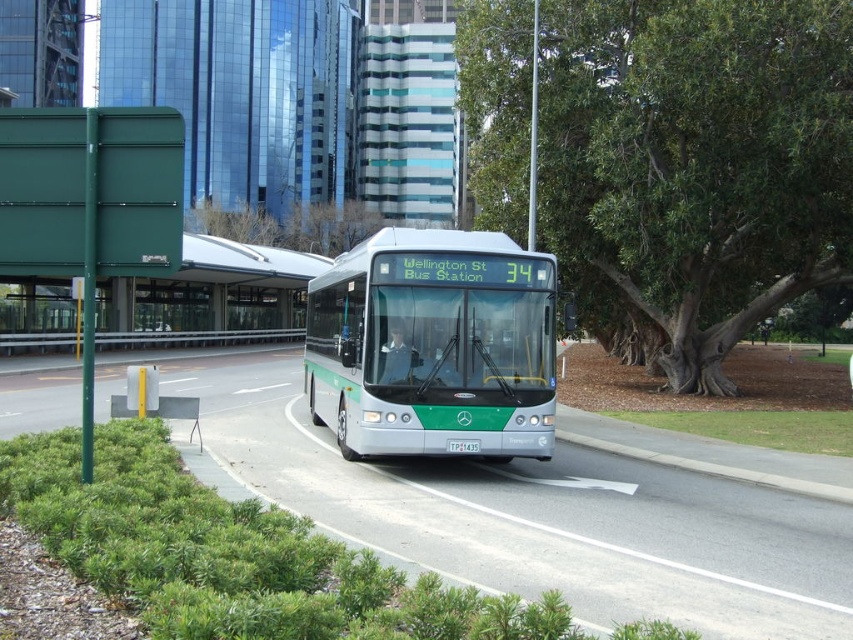
Is green leafy tree at center smaller than silver metallic bus at center?

Actually, green leafy tree at center might be larger than silver metallic bus at center.

I want to click on green leafy tree at center, so click(698, 160).

Between point (662, 88) and point (78, 380), which one is positioned in front?

Point (662, 88)

Does green leafy tree at center have a greater height compared to green metallic bus at center?

Indeed, green leafy tree at center has a greater height compared to green metallic bus at center.

Which is behind, point (735, 140) or point (349, 522)?

The point (735, 140) is behind.

Find the location of `green leafy tree at center`. green leafy tree at center is located at coordinates (698, 160).

Does point (386, 554) lie behind point (466, 452)?

No, (386, 554) is closer to viewer.

The height and width of the screenshot is (640, 853). Describe the element at coordinates (534, 515) in the screenshot. I see `green metallic bus at center` at that location.

The width and height of the screenshot is (853, 640). What are the coordinates of `green metallic bus at center` in the screenshot? It's located at (534, 515).

Locate an element on the screen. Image resolution: width=853 pixels, height=640 pixels. green metallic bus at center is located at coordinates point(534,515).